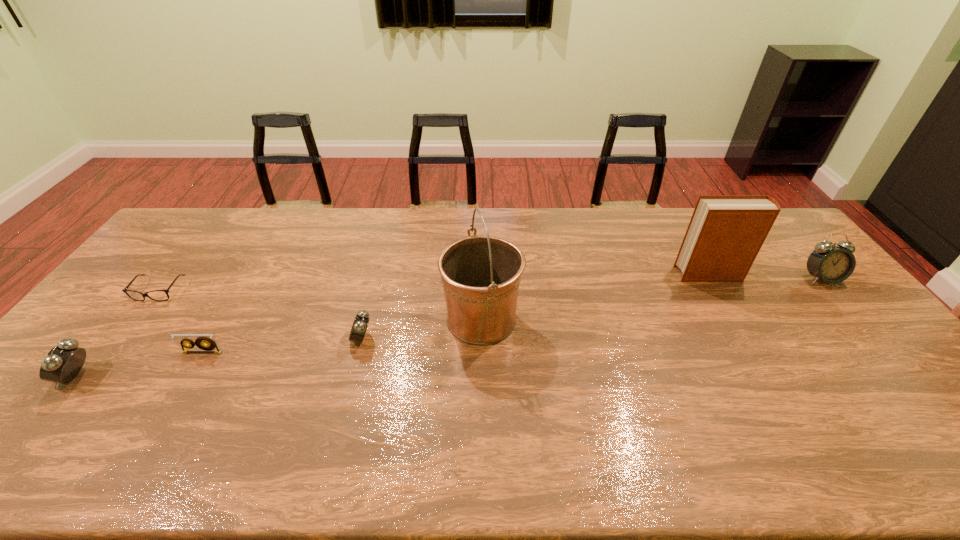
I want to click on hardback book, so click(x=726, y=232).

The image size is (960, 540). Find the location of `the sixth object from left to right`. the sixth object from left to right is located at coordinates (726, 232).

I want to click on spectacles, so click(125, 290).

You are a GUI agent. You are given a task and a screenshot of the screen. Output one action in this format:
    pyautogui.click(x=<x>, y=<y>)
    Task: Click on the blank space located 0.090m on the face of the fifth tallest object
    
    Given the screenshot: What is the action you would take?
    pyautogui.click(x=318, y=339)

Locate an element on the screen. The width and height of the screenshot is (960, 540). vacant space located on the face of the fifth tallest object is located at coordinates (289, 339).

Image resolution: width=960 pixels, height=540 pixels. In order to click on vacant space situated on the face of the fifth tallest object in this screenshot , I will do `click(300, 339)`.

The image size is (960, 540). I want to click on free space located 0.190m on the face of the third tallest object, so click(870, 335).

You are a GUI agent. You are given a task and a screenshot of the screen. Output one action in this format:
    pyautogui.click(x=<x>, y=<y>)
    Task: Click on the vacant space situated 0.210m at the front of the second shortest object with visible reels
    
    Given the screenshot: What is the action you would take?
    pyautogui.click(x=159, y=427)

Image resolution: width=960 pixels, height=540 pixels. I want to click on vacant space situated 0.100m on the back of the bucket, so click(481, 268).

Image resolution: width=960 pixels, height=540 pixels. I want to click on free space located on the open cover of the sixth shortest object, so click(564, 274).